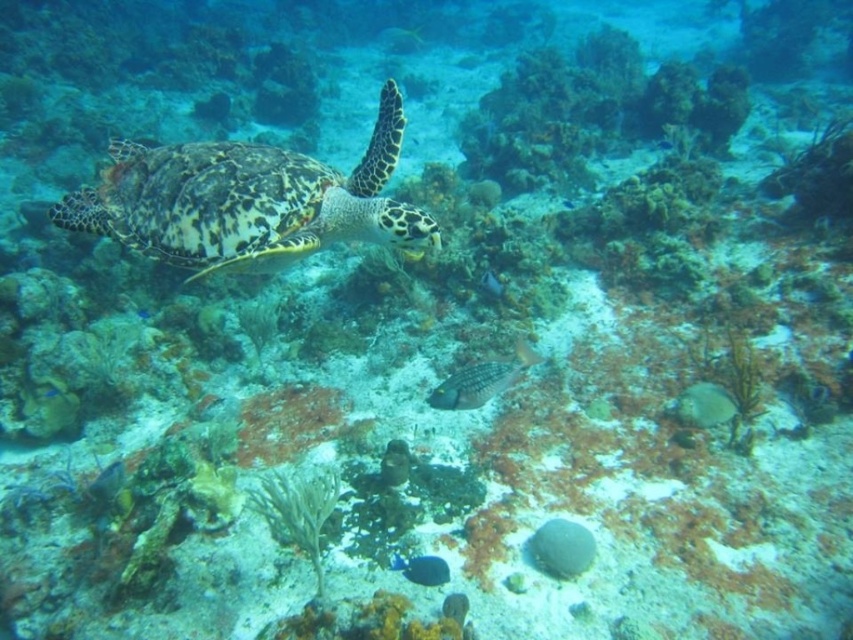
The image size is (853, 640). In order to click on leathery brown turtle at center in this screenshot , I will do `click(247, 200)`.

Is leathery brown turtle at center thinner than speckled brown fish at center?

No.

Where is `leathery brown turtle at center`? leathery brown turtle at center is located at coordinates (247, 200).

Where is `leathery brown turtle at center`? The image size is (853, 640). leathery brown turtle at center is located at coordinates pyautogui.click(x=247, y=200).

Does speckled brown fish at center have a lesser width compared to shiny silver fish at center?

Incorrect, speckled brown fish at center's width is not less than shiny silver fish at center's.

Is the position of speckled brown fish at center more distant than that of shiny silver fish at center?

No.

Is point (509, 355) more distant than point (492, 292)?

No, it is in front of (492, 292).

Find the location of a particular element. This screenshot has height=640, width=853. speckled brown fish at center is located at coordinates (480, 380).

Based on the photo, is leathery brown turtle at center positioned behind shiny silver fish at center?

No, it is in front of shiny silver fish at center.

Who is positioned more to the left, leathery brown turtle at center or shiny silver fish at center?

leathery brown turtle at center

Between point (164, 150) and point (498, 296), which one is positioned in front?

Positioned in front is point (164, 150).

The width and height of the screenshot is (853, 640). Find the location of `leathery brown turtle at center`. leathery brown turtle at center is located at coordinates (247, 200).